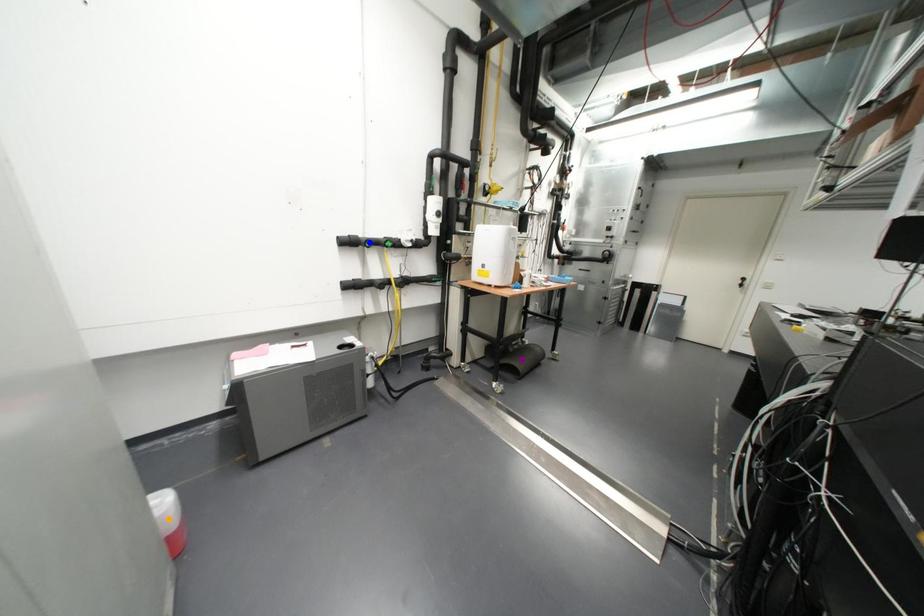
Order these from nearest to farthest:
1. blue point
2. orange point
3. purple point

1. orange point
2. blue point
3. purple point